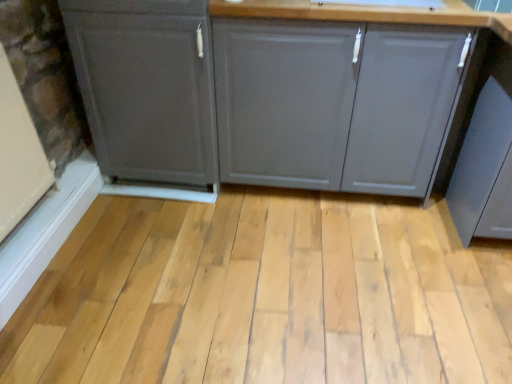
Question: Is natural wood plank at center situated inside matte gray cabinet at left, the first cabinetry viewed from the left, or outside?

Choices:
 (A) outside
 (B) inside

Answer: (A)

Question: Considering the positions of natural wood plank at center and matte gray cabinet at left, the first cabinetry viewed from the left, in the image, is natural wood plank at center bigger or smaller than matte gray cabinet at left, the first cabinetry viewed from the left,?

Choices:
 (A) small
 (B) big

Answer: (A)

Question: Estimate the real-world distances between objects in this image. Which object is closer to the matte gray cabinet at left, which is counted as the second cabinetry, starting from the right?

Choices:
 (A) natural wood plank at center
 (B) matte gray cabinet at center, positioned as the 1th cabinetry in right-to-left order

Answer: (B)

Question: Which object is the farthest from the matte gray cabinet at left, the first cabinetry viewed from the left?

Choices:
 (A) natural wood plank at center
 (B) matte gray cabinet at center, positioned as the 1th cabinetry in right-to-left order

Answer: (A)